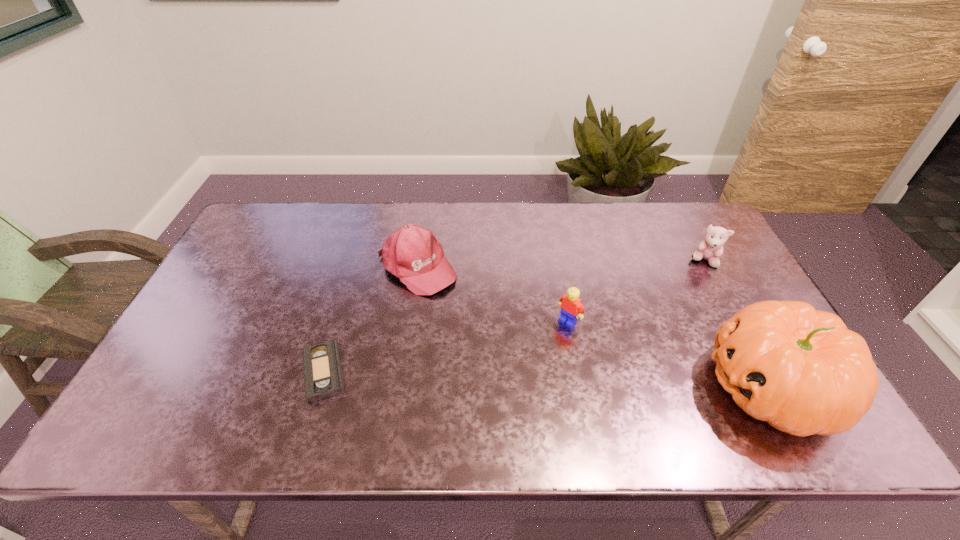
In the image, there is a desktop. Where is `free region at the far right corner`? The height and width of the screenshot is (540, 960). free region at the far right corner is located at coordinates (695, 221).

You are a GUI agent. You are given a task and a screenshot of the screen. Output one action in this format:
    pyautogui.click(x=<x>, y=<y>)
    Task: Click on the free spot between the shortest object and the teddy bear
    The width and height of the screenshot is (960, 540).
    Given the screenshot: What is the action you would take?
    pyautogui.click(x=515, y=316)

What are the coordinates of `free spot between the third farthest object and the baseball cap` in the screenshot? It's located at (492, 295).

Identify the location of free space between the shortest object and the third nearest object. The image size is (960, 540). (446, 347).

Identify the location of vacant space that is in between the pumpkin and the Lego. (670, 354).

Identify the location of unoccupied area between the baseball cap and the teddy bear. The height and width of the screenshot is (540, 960). [561, 265].

You are a GUI agent. You are given a task and a screenshot of the screen. Output one action in this format:
    pyautogui.click(x=<x>, y=<y>)
    Task: Click on the free space between the Lego and the teddy bear
    This screenshot has height=540, width=960.
    Given the screenshot: What is the action you would take?
    pyautogui.click(x=636, y=291)

Where is `free spot between the third object from right to left and the teddy bear`? The height and width of the screenshot is (540, 960). free spot between the third object from right to left and the teddy bear is located at coordinates (636, 291).

Locate an element on the screen. This screenshot has width=960, height=540. blank region between the tallest object and the videotape is located at coordinates (548, 379).

Where is `empty space between the videotape and the teddy bear`? The width and height of the screenshot is (960, 540). empty space between the videotape and the teddy bear is located at coordinates (515, 316).